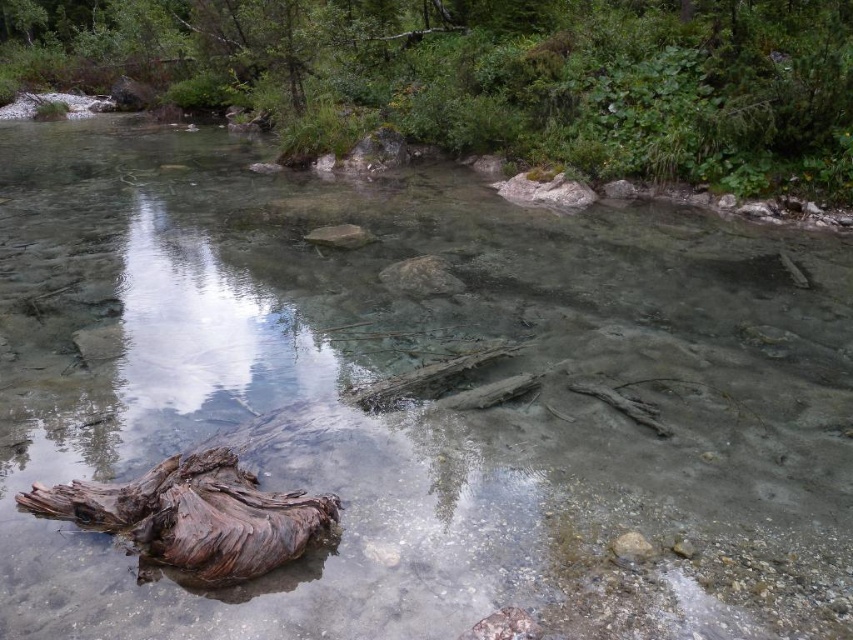
Question: Which point is farther to the camera?

Choices:
 (A) brown rough log at lower left
 (B) brown wood log at upper center

Answer: (B)

Question: Is brown wood log at upper center smaller than brown rough log at lower left?

Choices:
 (A) yes
 (B) no

Answer: (B)

Question: Is brown wood log at upper center smaller than brown rough log at lower left?

Choices:
 (A) yes
 (B) no

Answer: (B)

Question: Is brown wood log at upper center thinner than brown rough log at lower left?

Choices:
 (A) yes
 (B) no

Answer: (B)